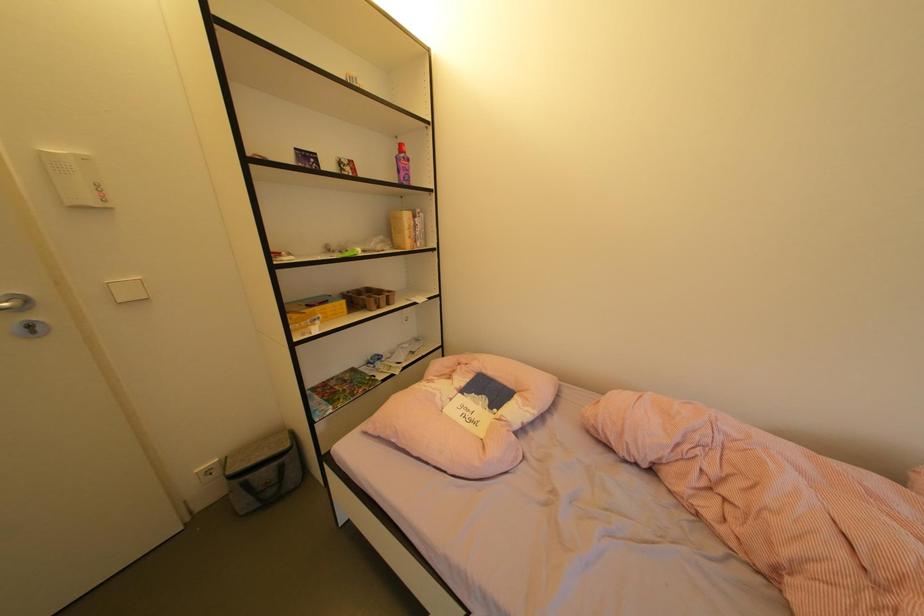
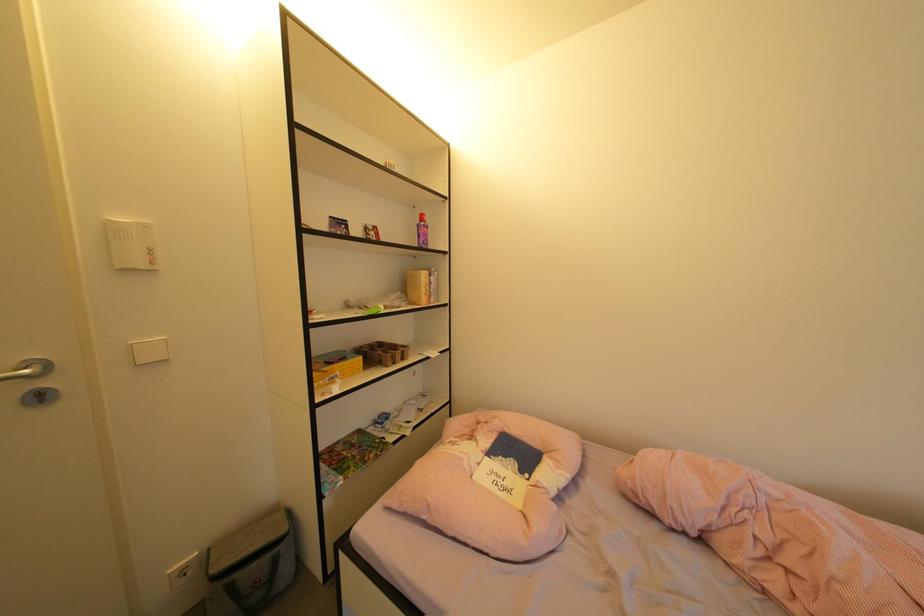
Question: The images are taken continuously from a first-person perspective. In which direction is your viewpoint rotating?

Choices:
 (A) Left
 (B) Right
 (C) Up
 (D) Down

Answer: (C)